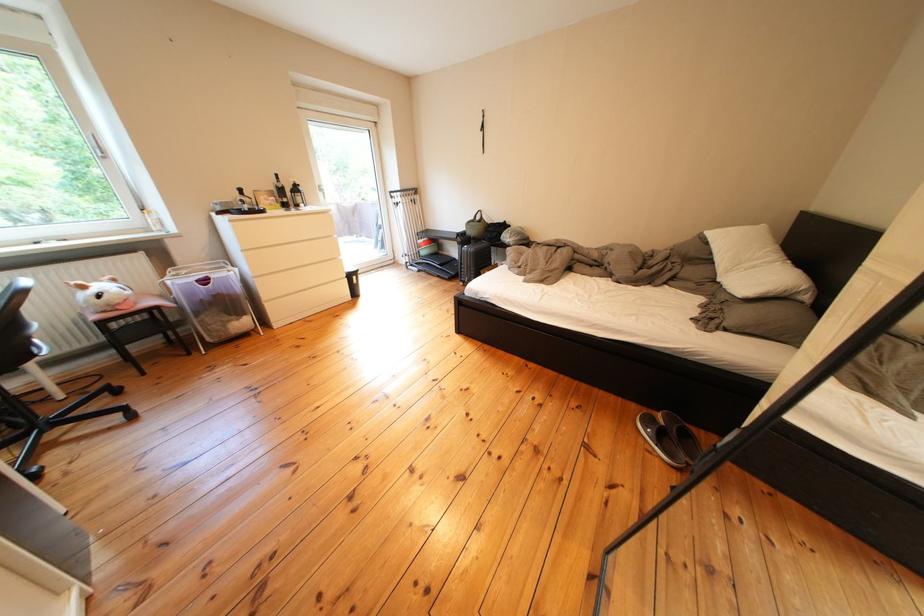
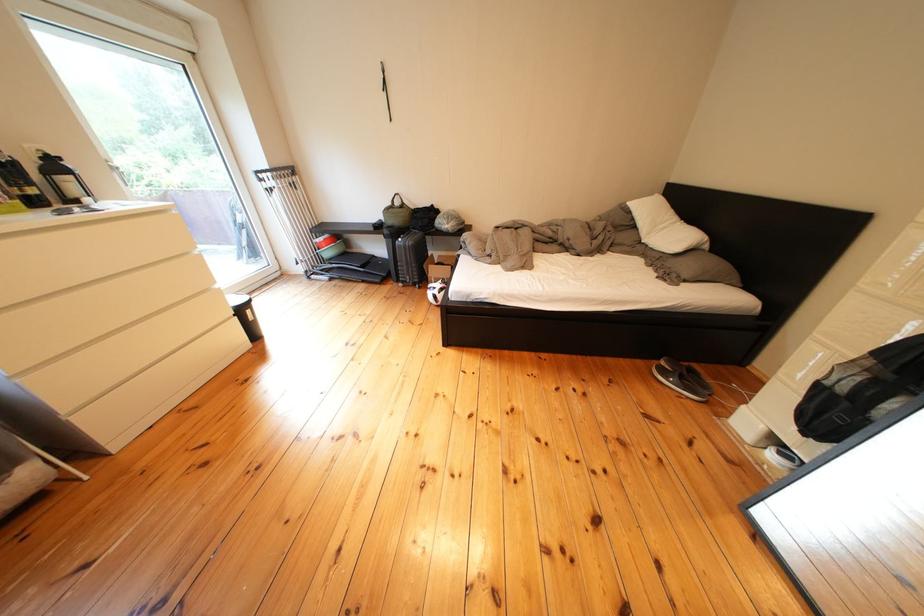
In the second image, find the point that corresponds to (x=472, y=244) in the first image.

(399, 236)